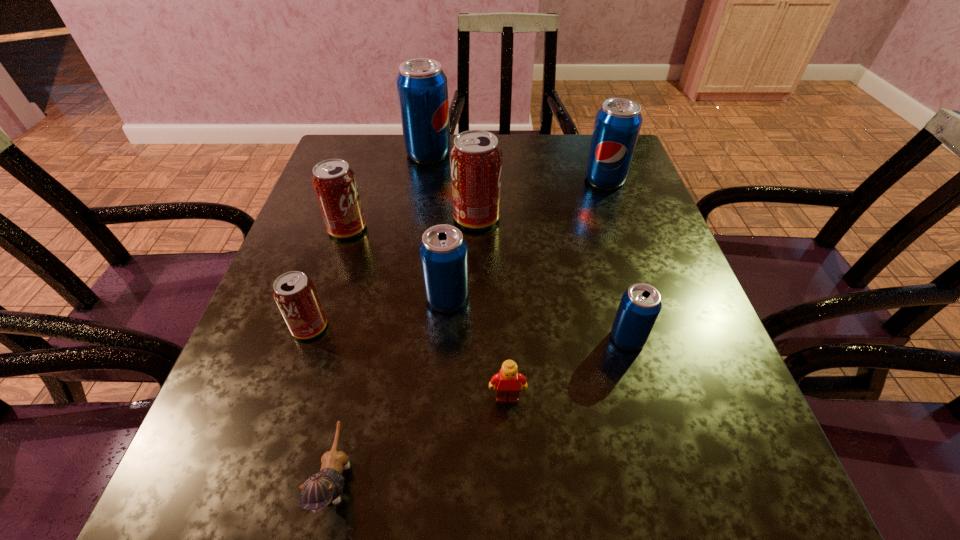
Choose which soda can is the second nearest neighbor to the nearest object. Please provide its 2D coordinates. Your answer should be formatted as a tuple, i.e. [(x, y)], where the tuple contains the x and y coordinates of a point satisfying the conditions above.

[(443, 250)]

Locate which blue pop soda ranks third in proximity to the kitten. Please provide its 2D coordinates. Your answer should be formatted as a tuple, i.e. [(x, y)], where the tuple contains the x and y coordinates of a point satisfying the conditions above.

[(422, 88)]

Identify which blue pop soda is located as the nearest to the second smallest red soda can. Please provide its 2D coordinates. Your answer should be formatted as a tuple, i.e. [(x, y)], where the tuple contains the x and y coordinates of a point satisfying the conditions above.

[(443, 250)]

Select which red soda can is the third closest to the tallest object. Please provide its 2D coordinates. Your answer should be formatted as a tuple, i.e. [(x, y)], where the tuple contains the x and y coordinates of a point satisfying the conditions above.

[(294, 293)]

Locate an element on the screen. the closest red soda can to the brown Lego is located at coordinates (294, 293).

Image resolution: width=960 pixels, height=540 pixels. I want to click on vacant space that satisfies the following two spatial constraints: 1. on the back side of the third farthest blue pop soda; 2. on the right side of the smallest red soda can, so click(320, 299).

I want to click on free space that satisfies the following two spatial constraints: 1. on the front side of the nearest red soda can; 2. on the right side of the smallest blue pop soda, so click(305, 339).